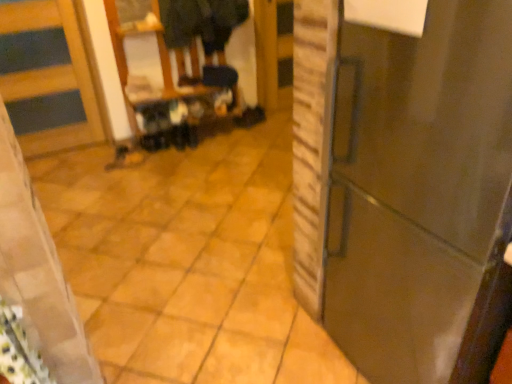
Question: Considering the positions of matte black shoe at center and glossy dark brown door at right, acting as the 2th door starting from the back, in the image, is matte black shoe at center taller or shorter than glossy dark brown door at right, acting as the 2th door starting from the back,?

Choices:
 (A) short
 (B) tall

Answer: (A)

Question: In terms of width, does matte black shoe at center look wider or thinner when compared to glossy dark brown door at right, which is counted as the first door, starting from the front?

Choices:
 (A) thin
 (B) wide

Answer: (A)

Question: Which is nearer to the matte black step stool at center?

Choices:
 (A) glossy dark brown door at right, positioned as the second door in left-to-right order
 (B) wooden door at left, which is counted as the second door, starting from the front
 (C) dark fabric coat at upper center
 (D) matte black shoe at center

Answer: (D)

Question: Estimate the real-world distances between objects in this image. Which object is farther from the glossy dark brown door at right, placed as the 1th door when sorted from right to left?

Choices:
 (A) dark fabric coat at upper center
 (B) matte black shoe at center
 (C) wooden door at left, which is the first door in back-to-front order
 (D) matte black step stool at center

Answer: (C)